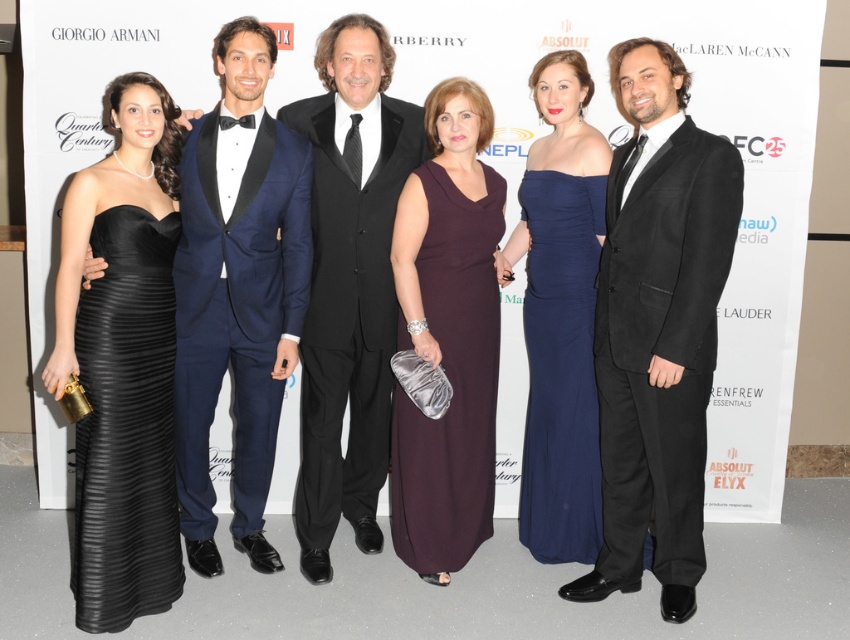
Question: Is black pleated dress at left below navy satin dress at center?

Choices:
 (A) no
 (B) yes

Answer: (B)

Question: Which of the following is the closest to the observer?

Choices:
 (A) (607, 216)
 (B) (378, 268)

Answer: (A)

Question: Is black suede suit at center positioned behind black pleated dress at left?

Choices:
 (A) yes
 (B) no

Answer: (B)

Question: Does black satin suit at center appear on the left side of dark purple satin dress at center?

Choices:
 (A) yes
 (B) no

Answer: (A)

Question: Which of the following is the closest to the observer?

Choices:
 (A) (476, 470)
 (B) (409, 161)
 (C) (80, 512)

Answer: (C)

Question: Which object is closer to the camera taking this photo?

Choices:
 (A) black pleated dress at left
 (B) navy blue tuxedo at center
 (C) black suede suit at center

Answer: (C)